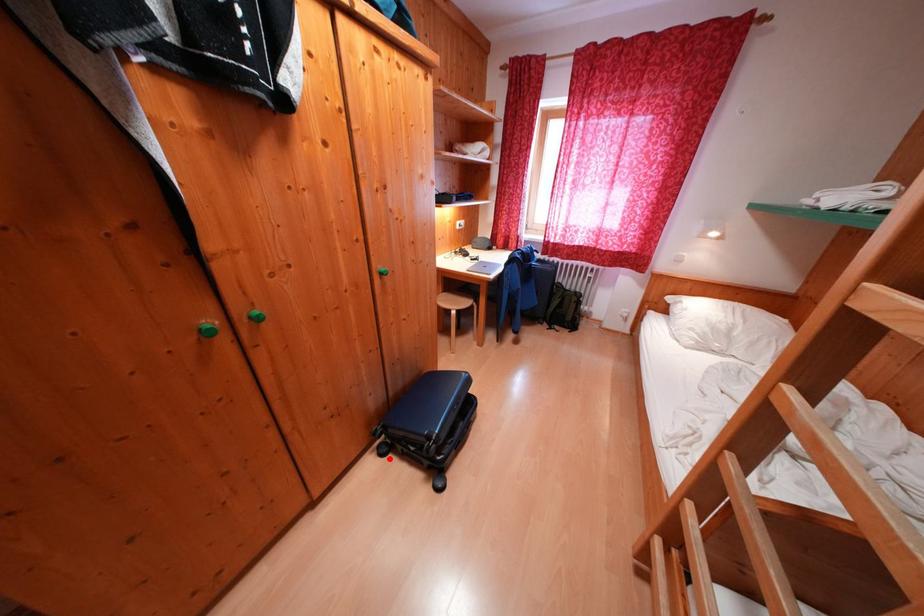
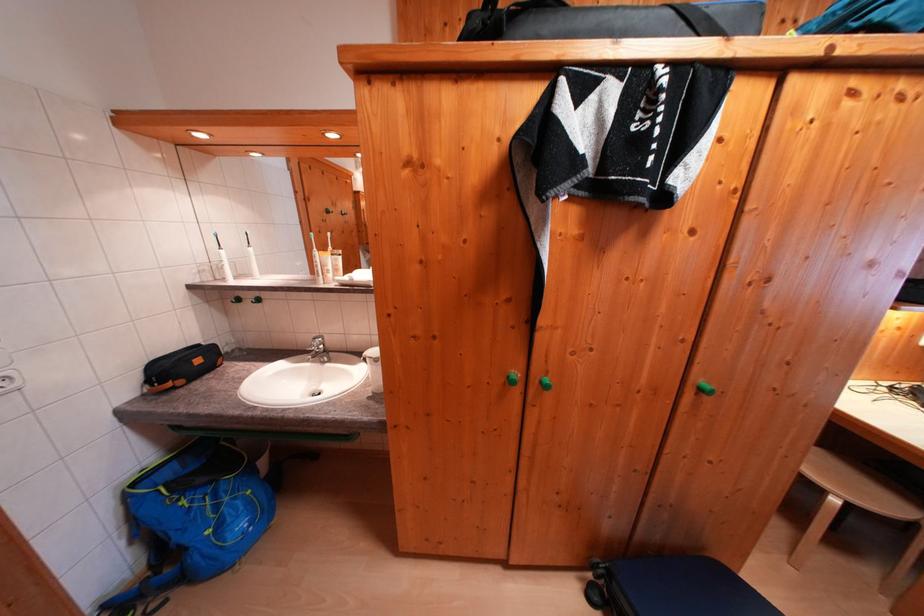
Where in the second image is the point corresponding to the highlighted location from the first image?

(598, 602)